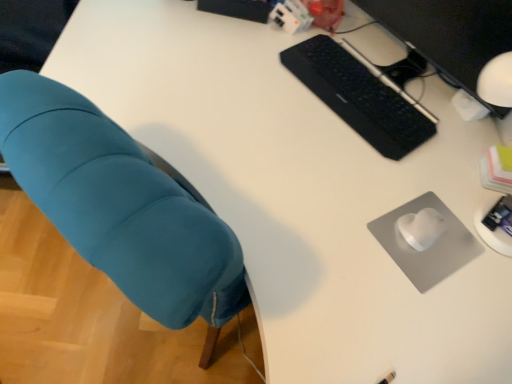
The width and height of the screenshot is (512, 384). Describe the element at coordinates (450, 34) in the screenshot. I see `black matte computer monitor at upper right` at that location.

What is the approximate width of black matte computer monitor at upper right?

black matte computer monitor at upper right is 5.68 inches in width.

Locate an element on the screen. This screenshot has height=384, width=512. teal fabric chair at left is located at coordinates (120, 207).

Who is more distant, gray matte mousepad at lower right or teal fabric chair at left?

teal fabric chair at left is further away from the camera.

From the image's perspective, is gray matte mousepad at lower right beneath teal fabric chair at left?

No.

Visually, is gray matte mousepad at lower right positioned to the left or to the right of teal fabric chair at left?

Clearly, gray matte mousepad at lower right is on the right of teal fabric chair at left in the image.

Locate an element on the screen. The image size is (512, 384). computer monitor above the gray matte mousepad at lower right (from a real-world perspective) is located at coordinates (450, 34).

Is black matte computer monitor at upper right inside the boundaries of gray matte mousepad at lower right, or outside?

black matte computer monitor at upper right is spatially situated outside gray matte mousepad at lower right.

How much distance is there between black matte computer monitor at upper right and gray matte mousepad at lower right?

black matte computer monitor at upper right and gray matte mousepad at lower right are 17.07 inches apart.

Does black matte computer monitor at upper right have a greater height compared to gray matte mousepad at lower right?

Yes.

Which is more to the left, teal fabric chair at left or black matte keyboard at upper right?

teal fabric chair at left is more to the left.

Would you say teal fabric chair at left is outside black matte keyboard at upper right?

That's correct, teal fabric chair at left is outside of black matte keyboard at upper right.

Find the location of a particular element. This screenshot has height=384, width=512. chair below the black matte keyboard at upper right (from a real-world perspective) is located at coordinates (120, 207).

Measure the distance between teal fabric chair at left and black matte computer monitor at upper right.

teal fabric chair at left is 33.56 inches away from black matte computer monitor at upper right.

In the image, is teal fabric chair at left positioned in front of or behind black matte computer monitor at upper right?

teal fabric chair at left is behind black matte computer monitor at upper right.

The image size is (512, 384). I want to click on chair on the left side of black matte computer monitor at upper right, so click(x=120, y=207).

Based on the photo, from the image's perspective, does teal fabric chair at left appear higher than black matte computer monitor at upper right?

No.

Can you confirm if black matte keyboard at upper right is bigger than black matte computer monitor at upper right?

Actually, black matte keyboard at upper right might be smaller than black matte computer monitor at upper right.

Which point is more forward, (368,87) or (380,14)?

The point (368,87) is closer to the camera.

Is black matte keyboard at upper right oriented away from black matte computer monitor at upper right?

Yes, black matte computer monitor at upper right is at the back of black matte keyboard at upper right.

Is black matte computer monitor at upper right positioned in front of black matte keyboard at upper right?

That is True.

Is black matte keyboard at upper right at the back of black matte computer monitor at upper right?

black matte computer monitor at upper right does not have its back to black matte keyboard at upper right.

Locate an element on the screen. The image size is (512, 384). computer monitor lying above the black matte keyboard at upper right (from the image's perspective) is located at coordinates (450, 34).

Is black matte keyboard at upper right next to gray matte mousepad at lower right and touching it?

No.

Between black matte keyboard at upper right and gray matte mousepad at lower right, which one has smaller size?

Smaller between the two is gray matte mousepad at lower right.

Considering the relative positions of black matte keyboard at upper right and gray matte mousepad at lower right in the image provided, is black matte keyboard at upper right behind gray matte mousepad at lower right?

Yes.

How much distance is there between black matte keyboard at upper right and gray matte mousepad at lower right?

31.26 centimeters.

This screenshot has width=512, height=384. In order to click on mousepad in front of the teal fabric chair at left in this screenshot , I will do `click(430, 247)`.

Locate an element on the screen. The height and width of the screenshot is (384, 512). mousepad below the black matte computer monitor at upper right (from a real-world perspective) is located at coordinates (430, 247).

Looking at the image, which one is located closer to black matte computer monitor at upper right, gray matte mousepad at lower right or black matte keyboard at upper right?

black matte keyboard at upper right lies closer to black matte computer monitor at upper right than the other object.

From the image, which object appears to be nearer to black matte computer monitor at upper right, teal fabric chair at left or black matte keyboard at upper right?

Based on the image, black matte keyboard at upper right appears to be nearer to black matte computer monitor at upper right.

From the image, which object appears to be farther from teal fabric chair at left, gray matte mousepad at lower right or black matte computer monitor at upper right?

black matte computer monitor at upper right is further to teal fabric chair at left.

Based on their spatial positions, is teal fabric chair at left or black matte computer monitor at upper right closer to gray matte mousepad at lower right?

black matte computer monitor at upper right lies closer to gray matte mousepad at lower right than the other object.

Considering their positions, is black matte computer monitor at upper right positioned closer to black matte keyboard at upper right than gray matte mousepad at lower right?

black matte computer monitor at upper right is positioned closer to the anchor black matte keyboard at upper right.

When comparing their distances from black matte computer monitor at upper right, does black matte keyboard at upper right or teal fabric chair at left seem further?

teal fabric chair at left is further to black matte computer monitor at upper right.

Considering their positions, is teal fabric chair at left positioned closer to black matte keyboard at upper right than gray matte mousepad at lower right?

gray matte mousepad at lower right is positioned closer to the anchor black matte keyboard at upper right.

Based on their spatial positions, is black matte keyboard at upper right or teal fabric chair at left closer to gray matte mousepad at lower right?

Based on the image, black matte keyboard at upper right appears to be nearer to gray matte mousepad at lower right.

The image size is (512, 384). What are the coordinates of `computer keyboard situated between teal fabric chair at left and black matte computer monitor at upper right from left to right` in the screenshot? It's located at (359, 96).

Locate an element on the screen. computer keyboard located between teal fabric chair at left and gray matte mousepad at lower right in the left-right direction is located at coordinates [359, 96].

At what (x,y) coordinates should I click in order to perform the action: click on mousepad located between teal fabric chair at left and black matte computer monitor at upper right in the left-right direction. Please return your answer as a coordinate pair (x, y). This screenshot has width=512, height=384. Looking at the image, I should click on (430, 247).

This screenshot has height=384, width=512. What are the coordinates of `computer keyboard between black matte computer monitor at upper right and gray matte mousepad at lower right vertically` in the screenshot? It's located at (359, 96).